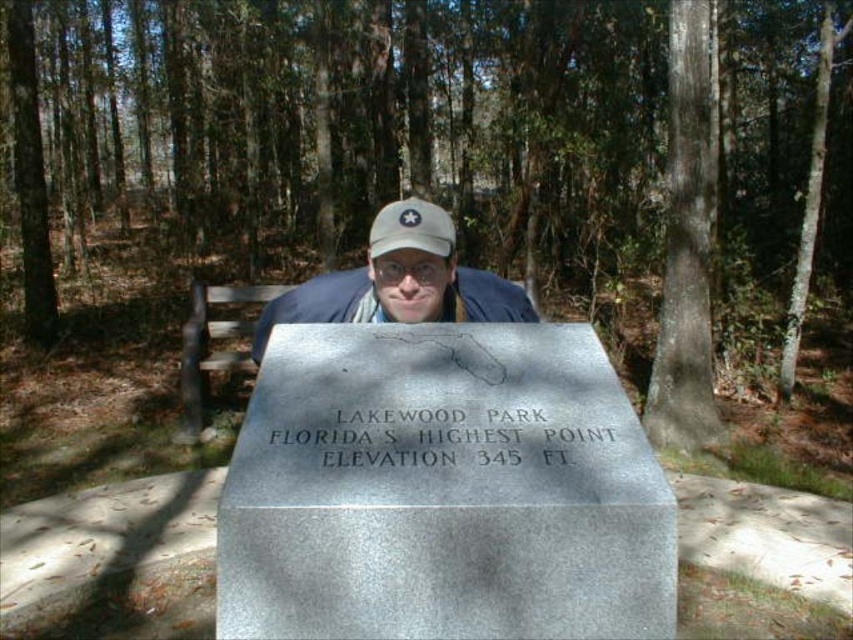
Question: Which is nearer to the white matte baseball cap at center?

Choices:
 (A) brown wooden bench at left
 (B) white matte cap at center

Answer: (B)

Question: Among these points, which one is nearest to the camera?

Choices:
 (A) pos(202,388)
 (B) pos(495,278)

Answer: (B)

Question: Can you confirm if white matte cap at center is positioned below white matte baseball cap at center?

Choices:
 (A) yes
 (B) no

Answer: (A)

Question: Does white matte cap at center appear under brown wooden bench at left?

Choices:
 (A) no
 (B) yes

Answer: (A)

Question: Does brown wooden bench at left have a greater width compared to white matte baseball cap at center?

Choices:
 (A) no
 (B) yes

Answer: (B)

Question: Which of these objects is positioned farthest from the white matte cap at center?

Choices:
 (A) white matte baseball cap at center
 (B) brown wooden bench at left

Answer: (B)